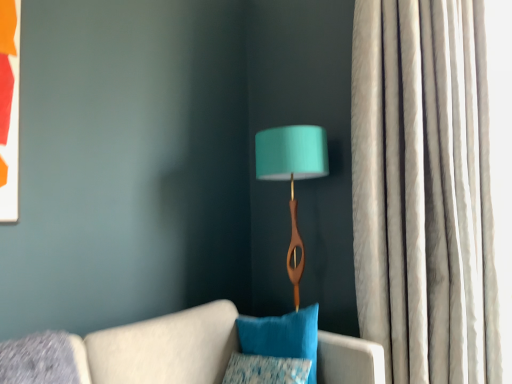
Question: Is textured blue pillow at lower center, the second pillow from the top, far away from silky white curtain at right?

Choices:
 (A) yes
 (B) no

Answer: (B)

Question: Can you confirm if textured blue pillow at lower center, the second pillow from the top, is shorter than silky white curtain at right?

Choices:
 (A) yes
 (B) no

Answer: (A)

Question: Is the depth of textured blue pillow at lower center, placed as the first pillow when sorted from bottom to top, greater than that of silky white curtain at right?

Choices:
 (A) yes
 (B) no

Answer: (B)

Question: From the image's perspective, is textured blue pillow at lower center, placed as the first pillow when sorted from bottom to top, below silky white curtain at right?

Choices:
 (A) no
 (B) yes

Answer: (B)

Question: Does textured blue pillow at lower center, placed as the first pillow when sorted from bottom to top, have a larger size compared to silky white curtain at right?

Choices:
 (A) no
 (B) yes

Answer: (A)

Question: From their relative heights in the image, would you say velvety blue pillow at center, the 2th pillow positioned from the bottom, is taller or shorter than textured blue pillow at lower center, the second pillow from the top?

Choices:
 (A) short
 (B) tall

Answer: (B)

Question: Does point (269, 347) appear closer or farther from the camera than point (266, 360)?

Choices:
 (A) farther
 (B) closer

Answer: (A)

Question: Based on their sizes in the image, would you say velvety blue pillow at center, the 2th pillow positioned from the bottom, is bigger or smaller than textured blue pillow at lower center, the second pillow from the top?

Choices:
 (A) big
 (B) small

Answer: (A)

Question: Would you say velvety blue pillow at center, placed as the 1th pillow when sorted from top to bottom, is to the left or to the right of textured blue pillow at lower center, the second pillow from the top, in the picture?

Choices:
 (A) right
 (B) left

Answer: (A)

Question: From the image's perspective, is teal fabric lampshade at center above or below textured blue pillow at lower center, placed as the first pillow when sorted from bottom to top?

Choices:
 (A) above
 (B) below

Answer: (A)

Question: In the image, is teal fabric lampshade at center positioned in front of or behind textured blue pillow at lower center, placed as the first pillow when sorted from bottom to top?

Choices:
 (A) behind
 (B) front

Answer: (A)

Question: Considering the positions of point (257, 140) and point (237, 380), is point (257, 140) closer or farther from the camera than point (237, 380)?

Choices:
 (A) farther
 (B) closer

Answer: (A)

Question: Considering the positions of teal fabric lampshade at center and textured blue pillow at lower center, placed as the first pillow when sorted from bottom to top, in the image, is teal fabric lampshade at center taller or shorter than textured blue pillow at lower center, placed as the first pillow when sorted from bottom to top,?

Choices:
 (A) tall
 (B) short

Answer: (A)

Question: From a real-world perspective, is velvety blue pillow at center, placed as the 1th pillow when sorted from top to bottom, above or below teal fabric lampshade at center?

Choices:
 (A) above
 (B) below

Answer: (B)

Question: From the image's perspective, is velvety blue pillow at center, the 2th pillow positioned from the bottom, above or below teal fabric lampshade at center?

Choices:
 (A) above
 (B) below

Answer: (B)